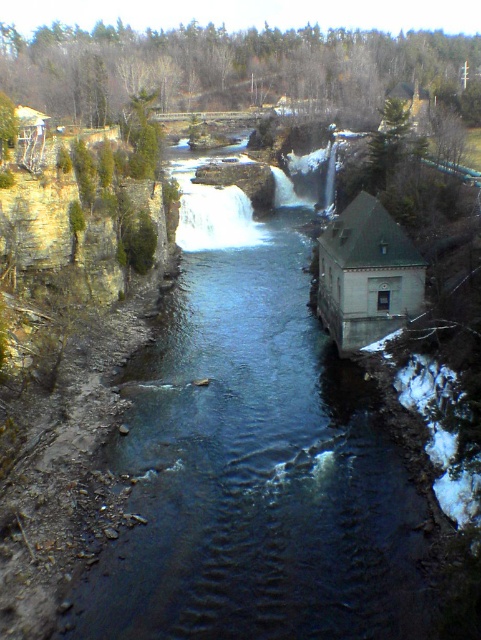
Question: Does dark blue water at center come behind gray stone mill at center-right?

Choices:
 (A) no
 (B) yes

Answer: (A)

Question: Can you confirm if dark blue water at center is positioned to the left of gray stone mill at center-right?

Choices:
 (A) yes
 (B) no

Answer: (A)

Question: Which object is positioned closest to the white frothy water at center?

Choices:
 (A) dark blue water at center
 (B) gray stone mill at center-right

Answer: (A)

Question: Which of the following is the farthest from the observer?

Choices:
 (A) (399, 280)
 (B) (249, 200)
 (C) (88, 588)

Answer: (B)

Question: Can you confirm if gray stone mill at center-right is wider than white frothy water at center?

Choices:
 (A) yes
 (B) no

Answer: (B)

Question: Which object is the closest to the gray stone mill at center-right?

Choices:
 (A) dark blue water at center
 (B) white frothy water at center

Answer: (A)